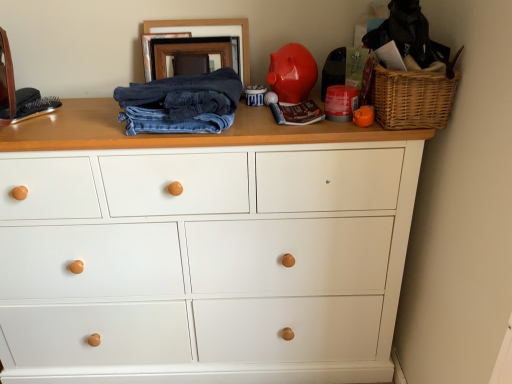
Question: Can woven brown basket at upper right be found inside glossy ceramic piggy bank at upper center?

Choices:
 (A) no
 (B) yes

Answer: (A)

Question: Can you confirm if glossy ceramic piggy bank at upper center is taller than woven brown basket at upper right?

Choices:
 (A) no
 (B) yes

Answer: (B)

Question: Are glossy ceramic piggy bank at upper center and woven brown basket at upper right making contact?

Choices:
 (A) yes
 (B) no

Answer: (B)

Question: Can you confirm if glossy ceramic piggy bank at upper center is shorter than woven brown basket at upper right?

Choices:
 (A) yes
 (B) no

Answer: (B)

Question: From a real-world perspective, is glossy ceramic piggy bank at upper center positioned over woven brown basket at upper right based on gravity?

Choices:
 (A) no
 (B) yes

Answer: (B)

Question: Considering the relative sizes of glossy ceramic piggy bank at upper center and woven brown basket at upper right in the image provided, is glossy ceramic piggy bank at upper center wider than woven brown basket at upper right?

Choices:
 (A) yes
 (B) no

Answer: (B)

Question: Considering the relative sizes of wooden picture frame at upper center and dark blue denim jeans at center in the image provided, is wooden picture frame at upper center thinner than dark blue denim jeans at center?

Choices:
 (A) yes
 (B) no

Answer: (A)

Question: Is wooden picture frame at upper center wider than dark blue denim jeans at center?

Choices:
 (A) no
 (B) yes

Answer: (A)

Question: Is wooden picture frame at upper center behind dark blue denim jeans at center?

Choices:
 (A) yes
 (B) no

Answer: (A)

Question: Considering the relative sizes of wooden picture frame at upper center and dark blue denim jeans at center in the image provided, is wooden picture frame at upper center smaller than dark blue denim jeans at center?

Choices:
 (A) no
 (B) yes

Answer: (B)

Question: Is wooden picture frame at upper center at the left side of dark blue denim jeans at center?

Choices:
 (A) no
 (B) yes

Answer: (B)

Question: Is wooden picture frame at upper center next to dark blue denim jeans at center and touching it?

Choices:
 (A) no
 (B) yes

Answer: (A)

Question: Is dark blue denim jeans at center not close to white matte chest of drawers at center?

Choices:
 (A) no
 (B) yes

Answer: (A)